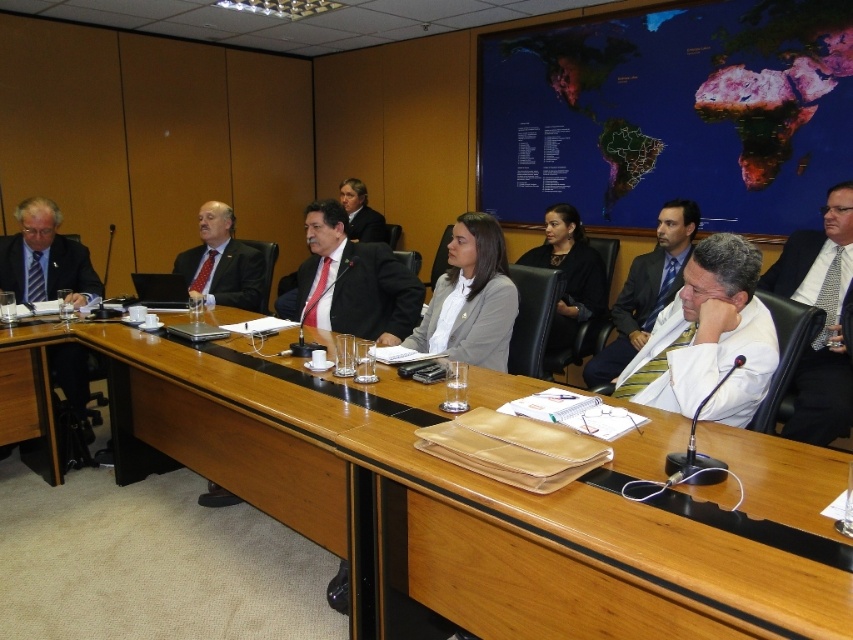
Question: Does white lab coat at center appear on the right side of matte black suit at center?

Choices:
 (A) yes
 (B) no

Answer: (A)

Question: Which point is farther to the camera?

Choices:
 (A) (664, 227)
 (B) (694, 372)
 (C) (473, 346)
 (D) (844, 260)

Answer: (A)

Question: Among these objects, which one is nearest to the camera?

Choices:
 (A) black fabric jacket at center
 (B) matte black suit at center

Answer: (B)

Question: Is the position of matte black suit at left more distant than that of matte black suit at center?

Choices:
 (A) no
 (B) yes

Answer: (A)

Question: Does wooden table at center appear under white lab coat at center?

Choices:
 (A) yes
 (B) no

Answer: (A)

Question: Which point is closer to the camera?

Choices:
 (A) (549, 212)
 (B) (482, 317)
 (C) (224, 260)

Answer: (B)